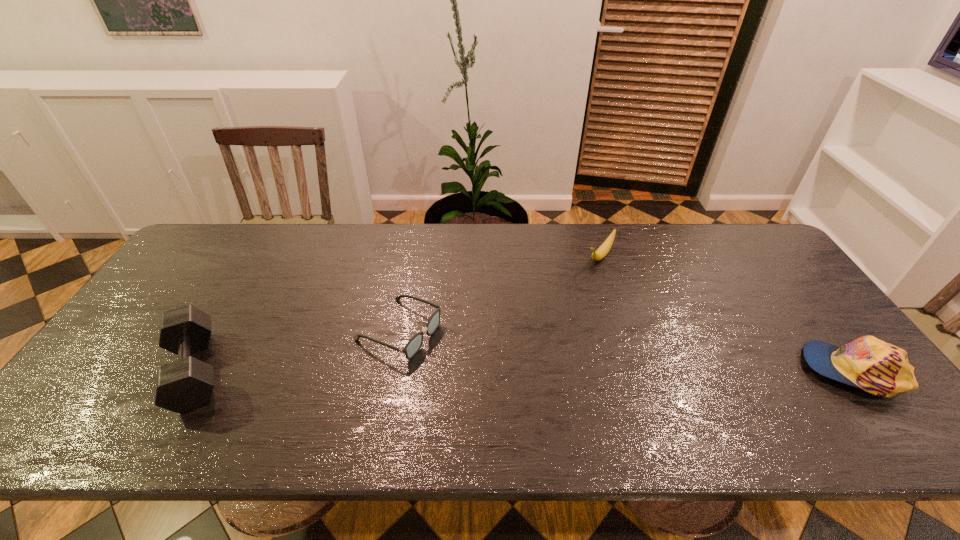
Find the location of `object that is at the right edge`. object that is at the right edge is located at coordinates [x=880, y=368].

I want to click on object that is at the near left corner, so click(x=185, y=384).

Find the location of a particular element. Image resolution: width=960 pixels, height=540 pixels. object that is positioned at the near right corner is located at coordinates (880, 368).

What are the coordinates of `vacant space at the far edge of the desktop` in the screenshot? It's located at [292, 230].

Locate an element on the screen. The height and width of the screenshot is (540, 960). vacant space at the near edge of the desktop is located at coordinates (231, 394).

Find the location of a particular element. vacant region at the far right corner of the desktop is located at coordinates (779, 264).

This screenshot has height=540, width=960. In order to click on unoccupied position between the second object from left to right and the farthest object in this screenshot , I will do click(x=500, y=293).

This screenshot has height=540, width=960. What are the coordinates of `vacant space that is in between the dumbbell and the shortest object` in the screenshot? It's located at (298, 350).

The height and width of the screenshot is (540, 960). Identify the location of blank region between the leftmost object and the cap. (524, 370).

The width and height of the screenshot is (960, 540). Find the location of `vacant area between the dumbbell and the spectacles`. vacant area between the dumbbell and the spectacles is located at coordinates (298, 350).